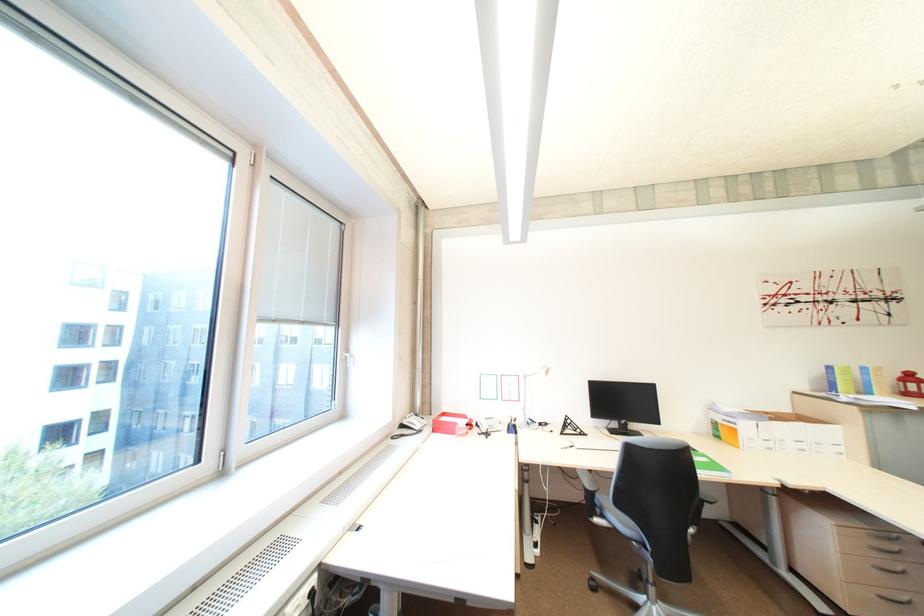
Find the location of a particular element. The height and width of the screenshot is (616, 924). white cardboard box is located at coordinates 737,426.